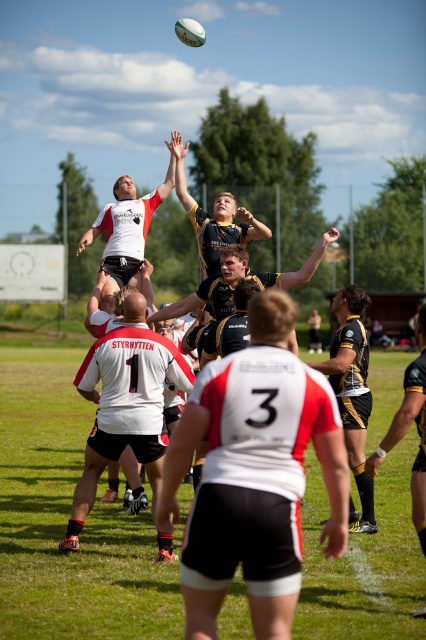
You are a referee positioned at the edge of the field and need to determine if the gold textured jersey at center is within the legal throwing distance of 3 meters from the white matte rugby ball at upper center. Can you confirm this?

The gold textured jersey at center is 3.20 meters away from the white matte rugby ball at upper center, which exceeds the legal throwing distance of 3 meters. Therefore, the player is out of bounds.

You are a referee positioned at the point with coordinates point (124, 404). Looking at the rugby lineout scene, which player are you closest to?

The point (124, 404) corresponds to the white matte jersey at center, so you are closest to the white matte jersey at center.